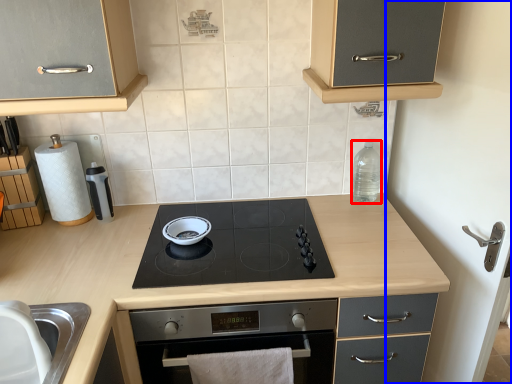
Question: Which of the following is the closest to the observer, bottle (highlighted by a red box) or side (highlighted by a blue box)?

Choices:
 (A) bottle
 (B) side

Answer: (B)